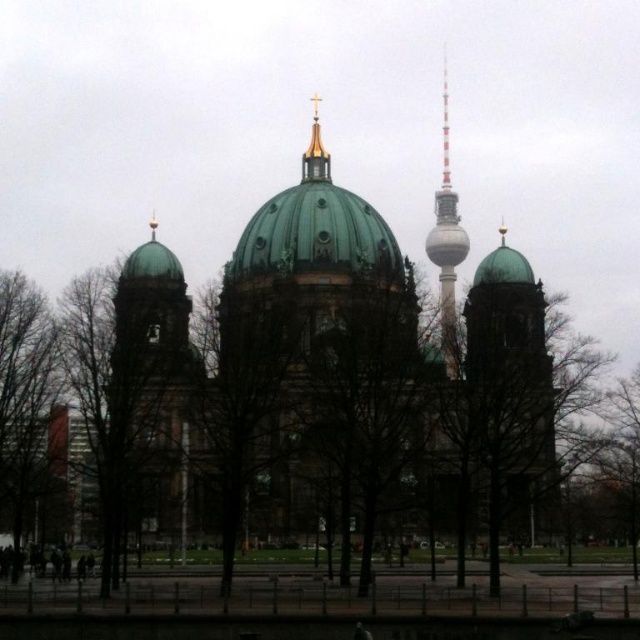
Question: Which object appears farthest from the camera in this image?

Choices:
 (A) bare branches at left
 (B) gold-plated spire at upper center
 (C) green matte tree at left

Answer: (B)

Question: Which point is farther to the camera?

Choices:
 (A) bare branches at left
 (B) gold-plated spire at upper center
 (C) white glass tower at upper right

Answer: (B)

Question: Is white glass tower at upper right behind gold-plated spire at upper center?

Choices:
 (A) yes
 (B) no

Answer: (B)

Question: Estimate the real-world distances between objects in this image. Which object is farther from the bare branches at left?

Choices:
 (A) green matte tree at left
 (B) gold-plated spire at upper center
 (C) white glass tower at upper right

Answer: (C)

Question: Is bare branches at left thinner than white glass tower at upper right?

Choices:
 (A) no
 (B) yes

Answer: (A)

Question: In this image, where is bare branches at left located relative to gold-plated spire at upper center?

Choices:
 (A) below
 (B) above

Answer: (A)